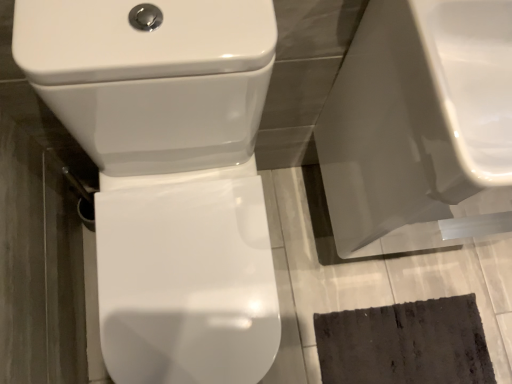
The image size is (512, 384). I want to click on vacant area on top of white glossy toilet seat at center (from a real-world perspective), so click(x=369, y=297).